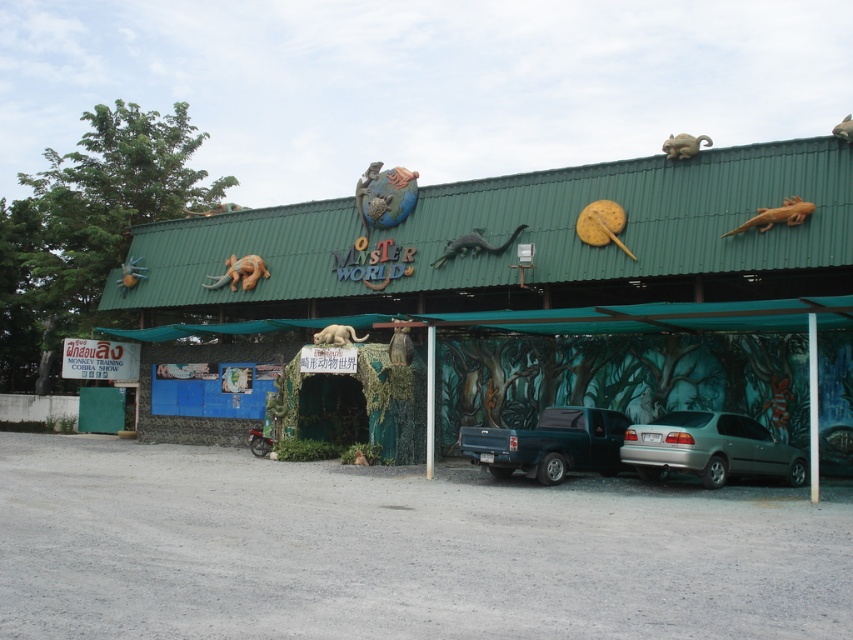
Who is shorter, green textured hut at center or silver metallic sedan at lower right?

silver metallic sedan at lower right

Does green textured hut at center appear over silver metallic sedan at lower right?

Indeed, green textured hut at center is positioned over silver metallic sedan at lower right.

I want to click on green textured hut at center, so click(550, 282).

You are a GUI agent. You are given a task and a screenshot of the screen. Output one action in this format:
    pyautogui.click(x=<x>, y=<y>)
    Task: Click on the green textured hut at center
    
    Given the screenshot: What is the action you would take?
    pyautogui.click(x=550, y=282)

Can you confirm if brown furry animal at center is positioned to the right of white fur cat at center?

Yes, brown furry animal at center is to the right of white fur cat at center.

Based on the photo, does brown furry animal at center appear under white fur cat at center?

Yes, brown furry animal at center is below white fur cat at center.

Locate an element on the screen. brown furry animal at center is located at coordinates (399, 346).

The width and height of the screenshot is (853, 640). I want to click on brown furry animal at center, so click(x=399, y=346).

Does brown textured lizard at center have a greater height compared to brown matte lizard at upper center?

Incorrect, brown textured lizard at center's height is not larger of brown matte lizard at upper center's.

Based on the photo, does brown textured lizard at center have a lesser height compared to brown matte lizard at upper center?

Correct, brown textured lizard at center is not as tall as brown matte lizard at upper center.

Identify the location of brown textured lizard at center. (239, 273).